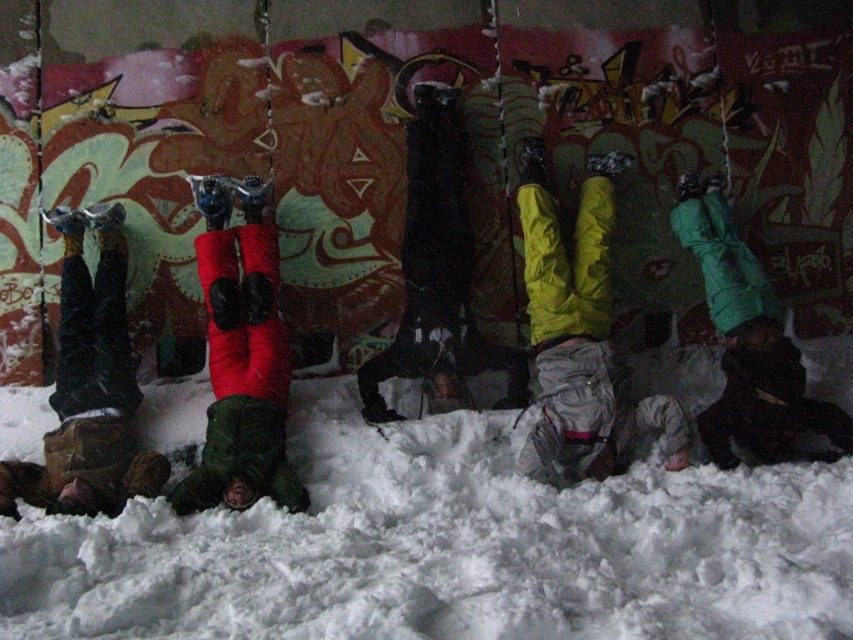
Question: Is white fluffy snow at center above red fabric pants at center?

Choices:
 (A) yes
 (B) no

Answer: (B)

Question: Does red fabric pants at center lie in front of green matte jacket at center?

Choices:
 (A) no
 (B) yes

Answer: (B)

Question: Where is white fluffy snow at center located in relation to red fabric pants at left in the image?

Choices:
 (A) above
 (B) below

Answer: (B)

Question: Which object is farther from the camera taking this photo?

Choices:
 (A) white fluffy snow at center
 (B) green matte jacket at center

Answer: (B)

Question: Which object is positioned farthest from the red fabric pants at center?

Choices:
 (A) white fluffy snow at center
 (B) red fabric pants at left
 (C) green matte jacket at center

Answer: (C)

Question: Which point is farther to the camera?

Choices:
 (A) (299, 538)
 (B) (238, 449)
 (C) (758, 340)
 (D) (68, 474)

Answer: (C)